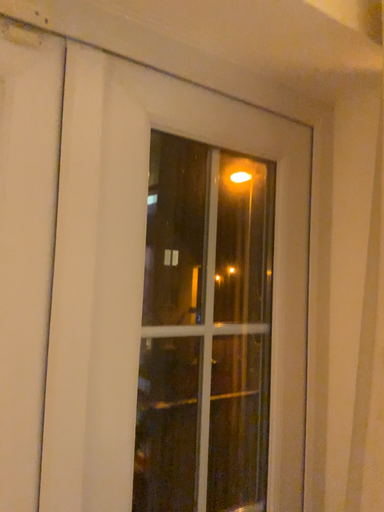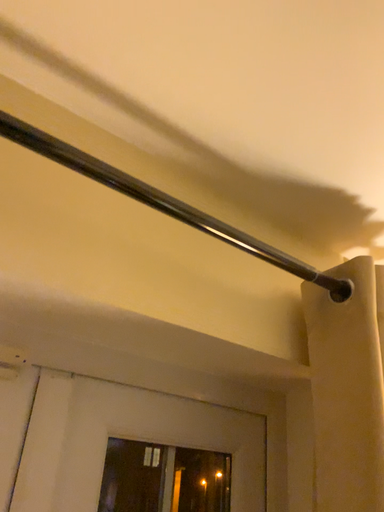
Question: Which way did the camera rotate in the video?

Choices:
 (A) rotated upward
 (B) rotated downward

Answer: (A)